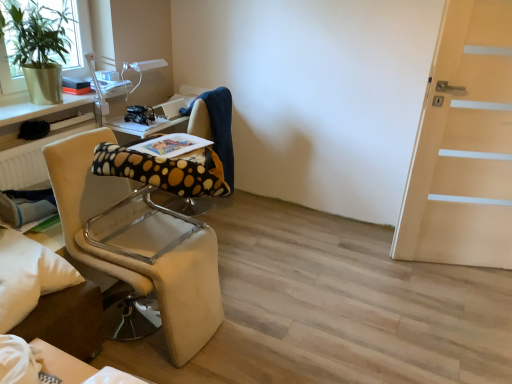
Measure the distance between point (20,46) and camera.

Point (20,46) is 7.49 feet from camera.

The width and height of the screenshot is (512, 384). What do you see at coordinates (36, 106) in the screenshot?
I see `metallic silver table at upper left` at bounding box center [36, 106].

Find the location of `light wood door at right`. light wood door at right is located at coordinates (463, 145).

Based on the photo, considering the relative positions of light wood door at right and white soft pillow at lower left in the image provided, is light wood door at right in front of white soft pillow at lower left?

That is False.

Can you confirm if light wood door at right is shorter than white soft pillow at lower left?

In fact, light wood door at right may be taller than white soft pillow at lower left.

From the image's perspective, is white soft pillow at lower left above or below metallic silver table at upper left?

white soft pillow at lower left is below metallic silver table at upper left.

Is white soft pillow at lower left next to metallic silver table at upper left?

They are not placed beside each other.

Where is `table lying behind the white soft pillow at lower left`? Image resolution: width=512 pixels, height=384 pixels. table lying behind the white soft pillow at lower left is located at coordinates (36, 106).

Considering the sizes of objects white soft pillow at lower left and metallic silver table at upper left in the image provided, who is wider, white soft pillow at lower left or metallic silver table at upper left?

Wider between the two is white soft pillow at lower left.

Considering the relative positions of beige fabric chair at left and light wood door at right in the image provided, is beige fabric chair at left to the right of light wood door at right from the viewer's perspective?

No.

From a real-world perspective, which object rests below the other?

In real-world perspective, beige fabric chair at left is lower.

Is beige fabric chair at left bigger than light wood door at right?

Yes.

Would you consider beige fabric chair at left to be distant from light wood door at right?

Indeed, beige fabric chair at left is not near light wood door at right.

Is green matte plant at upper left further to the viewer compared to beige fabric chair at left?

Yes, the depth of green matte plant at upper left is greater than that of beige fabric chair at left.

Can you confirm if green matte plant at upper left is taller than beige fabric chair at left?

In fact, green matte plant at upper left may be shorter than beige fabric chair at left.

Between green matte plant at upper left and beige fabric chair at left, which one has smaller width?

With smaller width is green matte plant at upper left.

Can you confirm if green matte plant at upper left is shorter than white soft pillow at lower left?

No, green matte plant at upper left is not shorter than white soft pillow at lower left.

Can you confirm if green matte plant at upper left is bigger than white soft pillow at lower left?

Indeed, green matte plant at upper left has a larger size compared to white soft pillow at lower left.

Is there a large distance between green matte plant at upper left and white soft pillow at lower left?

Yes, green matte plant at upper left and white soft pillow at lower left are located far from each other.

From the image's perspective, is black plastic headphones at center located above beige fabric chair at left?

Correct, black plastic headphones at center appears higher than beige fabric chair at left in the image.

Which object is closer to the camera, black plastic headphones at center or beige fabric chair at left?

Positioned in front is beige fabric chair at left.

Is black plastic headphones at center wider or thinner than beige fabric chair at left?

Clearly, black plastic headphones at center has less width compared to beige fabric chair at left.

Is black plastic headphones at center surrounding beige fabric chair at left?

No, beige fabric chair at left is not surrounded by black plastic headphones at center.

Considering the relative sizes of light wood door at right and green matte plant at upper left in the image provided, is light wood door at right wider than green matte plant at upper left?

In fact, light wood door at right might be narrower than green matte plant at upper left.

Which of these two, light wood door at right or green matte plant at upper left, stands shorter?

Standing shorter between the two is green matte plant at upper left.

Is point (487, 62) positioned in front of point (29, 26)?

Yes, it is in front of point (29, 26).

I want to click on door located above the white soft pillow at lower left (from the image's perspective), so coord(463,145).

You are a GUI agent. You are given a task and a screenshot of the screen. Output one action in this format:
    pyautogui.click(x=<x>, y=<y>)
    Task: Click on the pillow below the metallic silver table at upper left (from a real-world perspective)
    
    Given the screenshot: What is the action you would take?
    pyautogui.click(x=28, y=276)

From the image, which object appears to be nearer to polka dot fabric computer chair at center, black plastic headphones at center or light wood door at right?

black plastic headphones at center is positioned closer to the anchor polka dot fabric computer chair at center.

Based on their spatial positions, is white soft pillow at lower left or light wood door at right further from beige fabric chair at left?

Among the two, light wood door at right is located further to beige fabric chair at left.

Looking at this image, estimate the real-world distances between objects in this image. Which object is further from metallic silver table at upper left, light wood door at right or green matte plant at upper left?

light wood door at right is positioned further to the anchor metallic silver table at upper left.

Considering their positions, is white soft pillow at lower left positioned closer to polka dot fabric computer chair at center than beige fabric chair at left?

Among the two, beige fabric chair at left is located nearer to polka dot fabric computer chair at center.

Which object lies nearer to the anchor point polka dot fabric computer chair at center, light wood door at right or black plastic headphones at center?

black plastic headphones at center is closer to polka dot fabric computer chair at center.

Estimate the real-world distances between objects in this image. Which object is further from light wood door at right, green matte plant at upper left or black plastic headphones at center?

green matte plant at upper left is further to light wood door at right.

From the image, which object appears to be farther from black plastic headphones at center, green matte plant at upper left or light wood door at right?

Based on the image, light wood door at right appears to be further to black plastic headphones at center.

Based on their spatial positions, is light wood door at right or polka dot fabric computer chair at center further from metallic silver table at upper left?

Among the two, light wood door at right is located further to metallic silver table at upper left.

Where is `chair between white soft pillow at lower left and light wood door at right in the horizontal direction`? The height and width of the screenshot is (384, 512). chair between white soft pillow at lower left and light wood door at right in the horizontal direction is located at coordinates (138, 242).

Locate an element on the screen. The width and height of the screenshot is (512, 384). table between green matte plant at upper left and beige fabric chair at left from top to bottom is located at coordinates (36, 106).

At what (x,y) coordinates should I click in order to perform the action: click on houseplant between metallic silver table at upper left and light wood door at right from left to right. Please return your answer as a coordinate pair (x, y). The width and height of the screenshot is (512, 384). Looking at the image, I should click on (36, 34).

Identify the location of houseplant positioned between beige fabric chair at left and black plastic headphones at center from near to far. (36, 34).